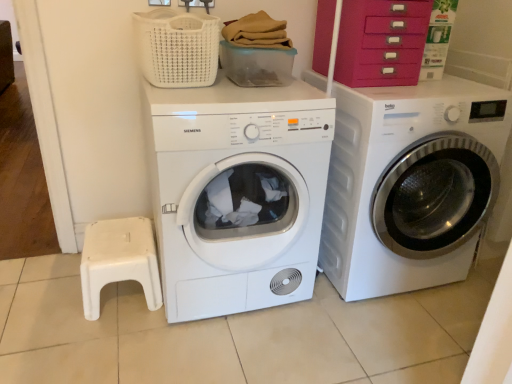
Describe the element at coordinates (119, 261) in the screenshot. Image resolution: width=512 pixels, height=384 pixels. I see `white plastic step stool at lower left` at that location.

This screenshot has width=512, height=384. Describe the element at coordinates (412, 184) in the screenshot. I see `white glossy washing machine at right, placed as the 2th washing machine when sorted from left to right` at that location.

What is the approximate width of white glossy washing machine at right, which appears as the 1th washing machine when viewed from the right?

white glossy washing machine at right, which appears as the 1th washing machine when viewed from the right, is 75.49 centimeters wide.

What do you see at coordinates (237, 193) in the screenshot? This screenshot has width=512, height=384. I see `white matte dryer at center, marked as the first washing machine in a left-to-right arrangement` at bounding box center [237, 193].

Where is `velvet pink drawer at upper right`? Image resolution: width=512 pixels, height=384 pixels. velvet pink drawer at upper right is located at coordinates (381, 42).

Based on the photo, between white matte dryer at center, positioned as the second washing machine in right-to-left order, and velvet pink drawer at upper right, which one appears on the right side from the viewer's perspective?

velvet pink drawer at upper right is more to the right.

Which of these two, white matte dryer at center, positioned as the second washing machine in right-to-left order, or velvet pink drawer at upper right, is bigger?

Bigger between the two is white matte dryer at center, positioned as the second washing machine in right-to-left order.

From the image's perspective, is white matte dryer at center, marked as the first washing machine in a left-to-right arrangement, positioned above or below velvet pink drawer at upper right?

Clearly, from the image's perspective, white matte dryer at center, marked as the first washing machine in a left-to-right arrangement, is below velvet pink drawer at upper right.

Is white matte dryer at center, positioned as the second washing machine in right-to-left order, positioned behind velvet pink drawer at upper right?

No.

How many degrees apart are the facing directions of velvet pink drawer at upper right and white matte dryer at center, marked as the first washing machine in a left-to-right arrangement?

velvet pink drawer at upper right and white matte dryer at center, marked as the first washing machine in a left-to-right arrangement, are facing 91.9 degrees away from each other.

Which of these two, velvet pink drawer at upper right or white matte dryer at center, marked as the first washing machine in a left-to-right arrangement, is bigger?

With larger size is white matte dryer at center, marked as the first washing machine in a left-to-right arrangement.

I want to click on the 2nd washing machine in front of the velvet pink drawer at upper right, counting from the anchor's position, so click(x=237, y=193).

Between point (335, 70) and point (155, 206), which one is positioned in front?

Point (155, 206)

From the image's perspective, between white glossy washing machine at right, placed as the 2th washing machine when sorted from left to right, and white woven basket at upper center, which one is located above?

From the image's view, white woven basket at upper center is above.

Can you confirm if white glossy washing machine at right, placed as the 2th washing machine when sorted from left to right, is smaller than white woven basket at upper center?

No, white glossy washing machine at right, placed as the 2th washing machine when sorted from left to right, is not smaller than white woven basket at upper center.

From a real-world perspective, is white glossy washing machine at right, placed as the 2th washing machine when sorted from left to right, on white woven basket at upper center?

No, from a real-world perspective, white glossy washing machine at right, placed as the 2th washing machine when sorted from left to right, is not over white woven basket at upper center

Is white glossy washing machine at right, placed as the 2th washing machine when sorted from left to right, aimed at white woven basket at upper center?

No, white glossy washing machine at right, placed as the 2th washing machine when sorted from left to right, is not aimed at white woven basket at upper center.

Is white matte dryer at center, positioned as the second washing machine in right-to-left order, in front of white woven basket at upper center?

Yes, it is.

Are white matte dryer at center, positioned as the second washing machine in right-to-left order, and white woven basket at upper center beside each other?

No, white matte dryer at center, positioned as the second washing machine in right-to-left order, is not in contact with white woven basket at upper center.

From the image's perspective, is white matte dryer at center, marked as the first washing machine in a left-to-right arrangement, above or below white woven basket at upper center?

From the image's perspective, white matte dryer at center, marked as the first washing machine in a left-to-right arrangement, appears below white woven basket at upper center.

Is white matte dryer at center, positioned as the second washing machine in right-to-left order, at the right side of white woven basket at upper center?

Yes.

Is white glossy washing machine at right, which appears as the 1th washing machine when viewed from the right, taller or shorter than white plastic step stool at lower left?

Considering their sizes, white glossy washing machine at right, which appears as the 1th washing machine when viewed from the right, has more height than white plastic step stool at lower left.

From a real-world perspective, is white glossy washing machine at right, which appears as the 1th washing machine when viewed from the right, located higher than white plastic step stool at lower left?

Correct, in the physical world, white glossy washing machine at right, which appears as the 1th washing machine when viewed from the right, is higher than white plastic step stool at lower left.

Based on the photo, is the position of white glossy washing machine at right, which appears as the 1th washing machine when viewed from the right, more distant than that of white plastic step stool at lower left?

No, white glossy washing machine at right, which appears as the 1th washing machine when viewed from the right, is closer to the camera.

Looking at the image, does white woven basket at upper center seem bigger or smaller compared to white matte dryer at center, positioned as the second washing machine in right-to-left order?

white woven basket at upper center is smaller than white matte dryer at center, positioned as the second washing machine in right-to-left order.

Considering the positions of points (170, 27) and (243, 208), is point (170, 27) closer to camera compared to point (243, 208)?

That is True.

Does white woven basket at upper center come in front of white matte dryer at center, positioned as the second washing machine in right-to-left order?

No, white woven basket at upper center is behind white matte dryer at center, positioned as the second washing machine in right-to-left order.

From the image's perspective, between white woven basket at upper center and white matte dryer at center, positioned as the second washing machine in right-to-left order, which one is located above?

From the image's view, white woven basket at upper center is above.

Is white woven basket at upper center in front of or behind velvet pink drawer at upper right in the image?

Visually, white woven basket at upper center is located in front of velvet pink drawer at upper right.

Is point (200, 54) positioned behind point (390, 72)?

No, it is not.

Looking at this image, is velvet pink drawer at upper right completely or partially inside white woven basket at upper center?

No.

What are the coordinates of `basket that is in front of the velvet pink drawer at upper right` in the screenshot? It's located at pos(177,47).

You are a GUI agent. You are given a task and a screenshot of the screen. Output one action in this format:
    pyautogui.click(x=<x>, y=<y>)
    Task: Click on the drawer above the white matte dryer at center, marked as the first washing machine in a left-to-right arrangement (from a real-world perspective)
    This screenshot has height=384, width=512.
    Given the screenshot: What is the action you would take?
    pyautogui.click(x=381, y=42)

The height and width of the screenshot is (384, 512). What are the coordinates of `washing machine that is on the left side of velvet pink drawer at upper right` in the screenshot? It's located at (237, 193).

Estimate the real-world distances between objects in this image. Which object is closer to white plastic step stool at lower left, white woven basket at upper center or velvet pink drawer at upper right?

white woven basket at upper center.

Looking at the image, which one is located further to white woven basket at upper center, white matte dryer at center, marked as the first washing machine in a left-to-right arrangement, or white glossy washing machine at right, placed as the 2th washing machine when sorted from left to right?

Among the two, white glossy washing machine at right, placed as the 2th washing machine when sorted from left to right, is located further to white woven basket at upper center.

From the image, which object appears to be nearer to velvet pink drawer at upper right, white matte dryer at center, marked as the first washing machine in a left-to-right arrangement, or white woven basket at upper center?

white matte dryer at center, marked as the first washing machine in a left-to-right arrangement, is positioned closer to the anchor velvet pink drawer at upper right.

Looking at the image, which one is located closer to velvet pink drawer at upper right, white plastic step stool at lower left or white matte dryer at center, marked as the first washing machine in a left-to-right arrangement?

The object closer to velvet pink drawer at upper right is white matte dryer at center, marked as the first washing machine in a left-to-right arrangement.

From the image, which object appears to be nearer to white matte dryer at center, positioned as the second washing machine in right-to-left order, white glossy washing machine at right, placed as the 2th washing machine when sorted from left to right, or white plastic step stool at lower left?

Among the two, white plastic step stool at lower left is located nearer to white matte dryer at center, positioned as the second washing machine in right-to-left order.

From the image, which object appears to be nearer to white plastic step stool at lower left, velvet pink drawer at upper right or white matte dryer at center, marked as the first washing machine in a left-to-right arrangement?

white matte dryer at center, marked as the first washing machine in a left-to-right arrangement, lies closer to white plastic step stool at lower left than the other object.

Based on their spatial positions, is white glossy washing machine at right, placed as the 2th washing machine when sorted from left to right, or white woven basket at upper center further from white matte dryer at center, positioned as the second washing machine in right-to-left order?

Among the two, white glossy washing machine at right, placed as the 2th washing machine when sorted from left to right, is located further to white matte dryer at center, positioned as the second washing machine in right-to-left order.

Based on the photo, based on their spatial positions, is velvet pink drawer at upper right or white glossy washing machine at right, which appears as the 1th washing machine when viewed from the right, further from white woven basket at upper center?

white glossy washing machine at right, which appears as the 1th washing machine when viewed from the right.

Image resolution: width=512 pixels, height=384 pixels. I want to click on washing machine situated between white woven basket at upper center and velvet pink drawer at upper right from left to right, so click(x=237, y=193).

At what (x,y) coordinates should I click in order to perform the action: click on drawer situated between white woven basket at upper center and white glossy washing machine at right, which appears as the 1th washing machine when viewed from the right, from left to right. Please return your answer as a coordinate pair (x, y). This screenshot has width=512, height=384. Looking at the image, I should click on (381, 42).

Find the location of a particular element. The image size is (512, 384). washing machine between white plastic step stool at lower left and white glossy washing machine at right, which appears as the 1th washing machine when viewed from the right, in the horizontal direction is located at coordinates (237, 193).

Locate an element on the screen. The height and width of the screenshot is (384, 512). washing machine between white woven basket at upper center and white glossy washing machine at right, which appears as the 1th washing machine when viewed from the right, from left to right is located at coordinates (237, 193).